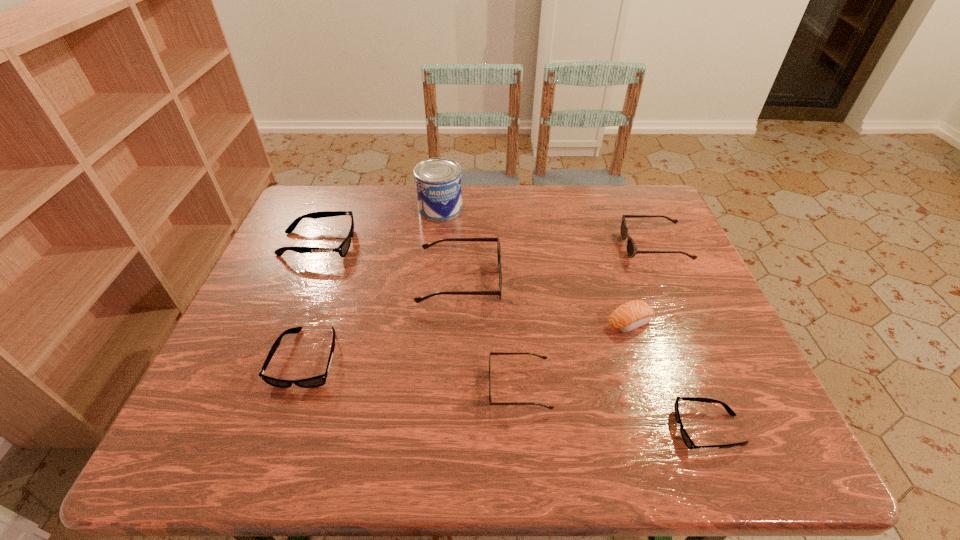
Locate an element on the screen. The width and height of the screenshot is (960, 540). vacant space located 0.110m on the front lenses of the smallest brown sunglasses is located at coordinates (436, 387).

This screenshot has height=540, width=960. In order to click on vacant space located on the front lenses of the smallest brown sunglasses in this screenshot , I will do `click(402, 387)`.

Where is `free space located 0.300m on the front-facing side of the shortest sunglasses`? free space located 0.300m on the front-facing side of the shortest sunglasses is located at coordinates (519, 429).

You are a GUI agent. You are given a task and a screenshot of the screen. Output one action in this format:
    pyautogui.click(x=<x>, y=<y>)
    Task: Click on the vacant space located 0.160m on the front-facing side of the shortest sunglasses
    The image size is (960, 540).
    Given the screenshot: What is the action you would take?
    pyautogui.click(x=592, y=429)

Identify the location of vacant space positioned 0.360m on the front-facing side of the shortest sunglasses. [x=489, y=429].

Locate an element on the screen. The width and height of the screenshot is (960, 540). can that is at the far edge is located at coordinates (438, 183).

In order to click on object at the near edge in this screenshot , I will do `click(689, 443)`.

Image resolution: width=960 pixels, height=540 pixels. What are the coordinates of `sushi at the right edge` in the screenshot? It's located at (631, 315).

What are the coordinates of `object that is at the far left corner` in the screenshot? It's located at (344, 247).

Where is `object that is positioned at the far right corner`? object that is positioned at the far right corner is located at coordinates (632, 250).